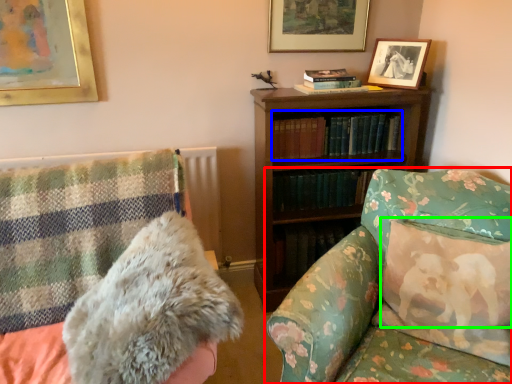
Question: Considering the real-world distances, which object is closest to studio couch (highlighted by a red box)? book (highlighted by a blue box) or pillow (highlighted by a green box).

Choices:
 (A) book
 (B) pillow

Answer: (B)